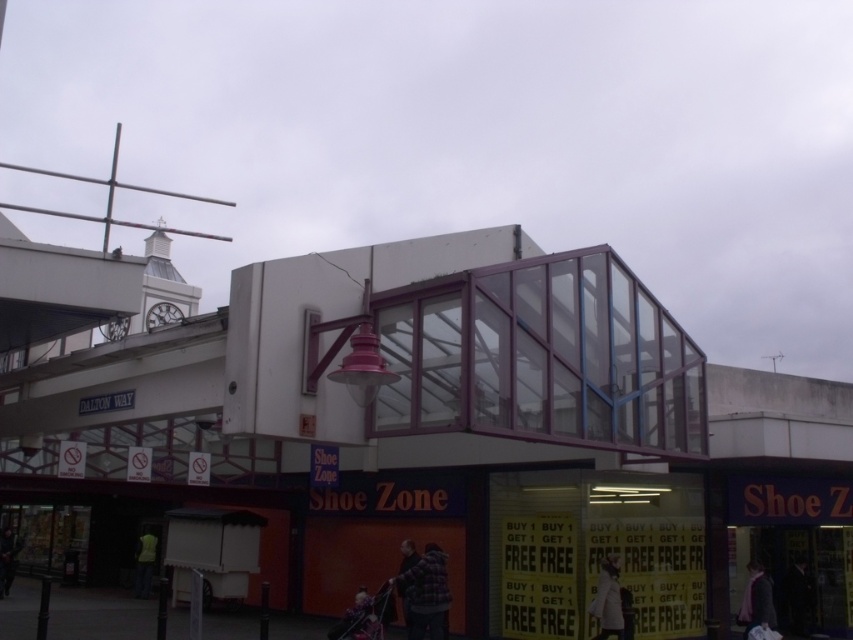
Question: Does white matte mall at center have a larger size compared to white fabric coat at lower right?

Choices:
 (A) yes
 (B) no

Answer: (A)

Question: Is white matte mall at center below white fabric coat at lower right?

Choices:
 (A) no
 (B) yes

Answer: (A)

Question: Which of the following is the farthest from the observer?

Choices:
 (A) white fabric coat at lower right
 (B) dark brown leather jacket at center

Answer: (A)

Question: Considering the relative positions of neon yellow jacket at lower left and dark gray jacket at lower left in the image provided, where is neon yellow jacket at lower left located with respect to dark gray jacket at lower left?

Choices:
 (A) below
 (B) above

Answer: (B)

Question: Which of these objects is positioned closest to the neon yellow jacket at lower left?

Choices:
 (A) dark gray jacket at lower right
 (B) dark brown leather jacket at center
 (C) white matte mall at center

Answer: (C)

Question: Which object is farther from the camera taking this photo?

Choices:
 (A) white matte mall at center
 (B) dark gray jacket at lower right

Answer: (B)